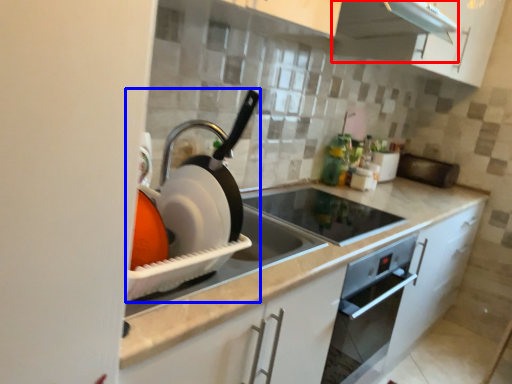
Question: Which object appears closest to the camera in this image, exhaust hood (highlighted by a red box) or appliance (highlighted by a blue box)?

Choices:
 (A) exhaust hood
 (B) appliance

Answer: (B)